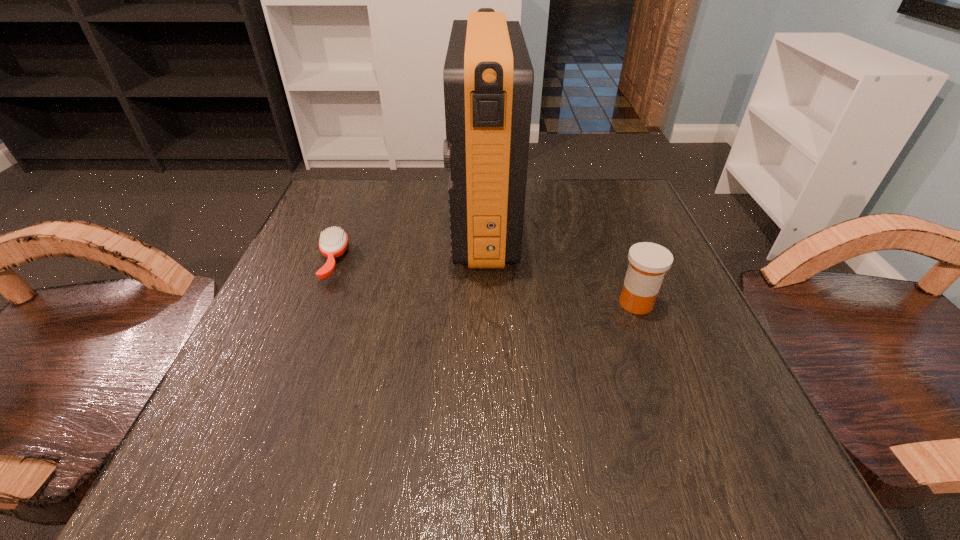
Identify the location of the second object from left to right. (488, 77).

Where is `radio receiver`? radio receiver is located at coordinates (488, 77).

Locate an element on the screen. the second shortest object is located at coordinates (648, 262).

I want to click on the nearest object, so click(648, 262).

This screenshot has width=960, height=540. Identify the location of hairbrush. (333, 243).

The height and width of the screenshot is (540, 960). In order to click on the shortest object in this screenshot , I will do `click(333, 243)`.

Identify the location of blank space located on the front-facing side of the second object from left to right. (355, 223).

The height and width of the screenshot is (540, 960). What are the coordinates of `free location located on the front-facing side of the second object from left to right` in the screenshot? It's located at (351, 223).

You are a GUI agent. You are given a task and a screenshot of the screen. Output one action in this format:
    pyautogui.click(x=<x>, y=<y>)
    Task: Click on the free space located 0.280m on the front-facing side of the second object from left to right
    Image resolution: width=960 pixels, height=540 pixels.
    Given the screenshot: What is the action you would take?
    pyautogui.click(x=324, y=223)

In order to click on free space located 0.070m on the label of the rightmost object in this screenshot , I will do `click(576, 303)`.